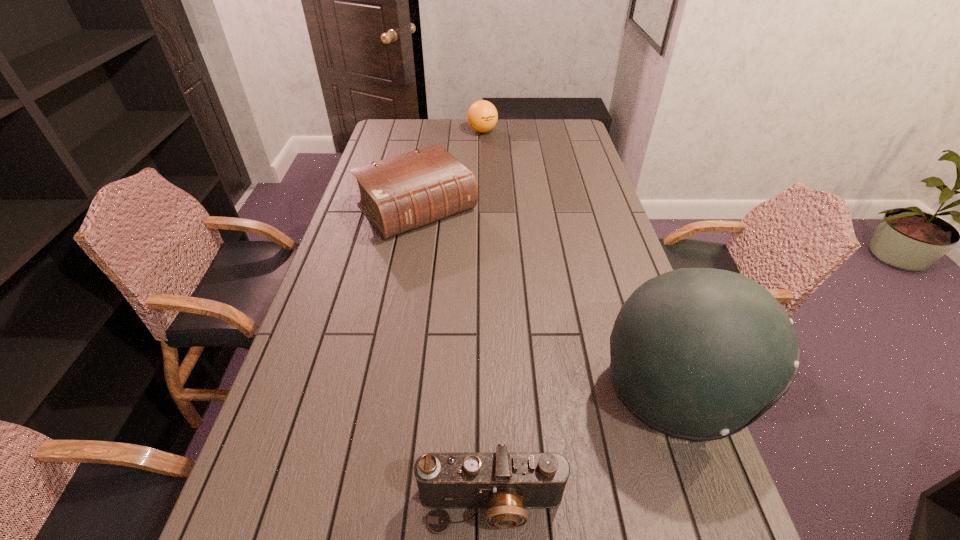
Image resolution: width=960 pixels, height=540 pixels. Find the location of `free space in the image that satisfies the following two spatial constraints: 1. on the back side of the ping-pong ball; 2. on the left side of the second farthest object`. free space in the image that satisfies the following two spatial constraints: 1. on the back side of the ping-pong ball; 2. on the left side of the second farthest object is located at coordinates (431, 131).

Locate an element on the screen. vacant point that satisfies the following two spatial constraints: 1. on the front side of the football helmet; 2. at the face opening of the ping-pong ball is located at coordinates (485, 391).